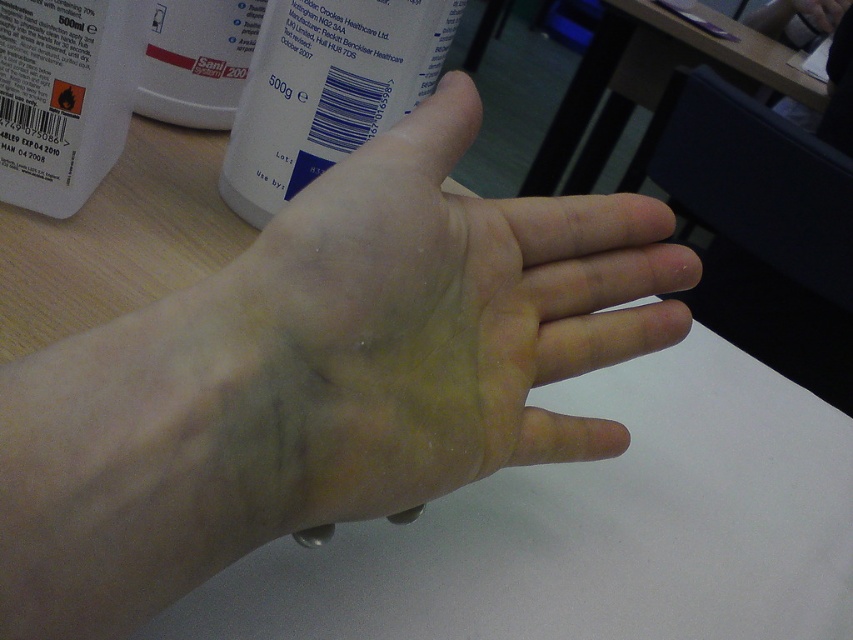
Is point (399, 465) positioned before point (410, 88)?

Yes, it is in front of point (410, 88).

Can you confirm if pale skin hand at center is positioned to the right of white plastic bottle at upper center?

Yes, pale skin hand at center is to the right of white plastic bottle at upper center.

Measure the distance between point [584,284] and camera.

A distance of 10.69 inches exists between point [584,284] and camera.

This screenshot has width=853, height=640. In order to click on pale skin hand at center in this screenshot , I will do coord(439,320).